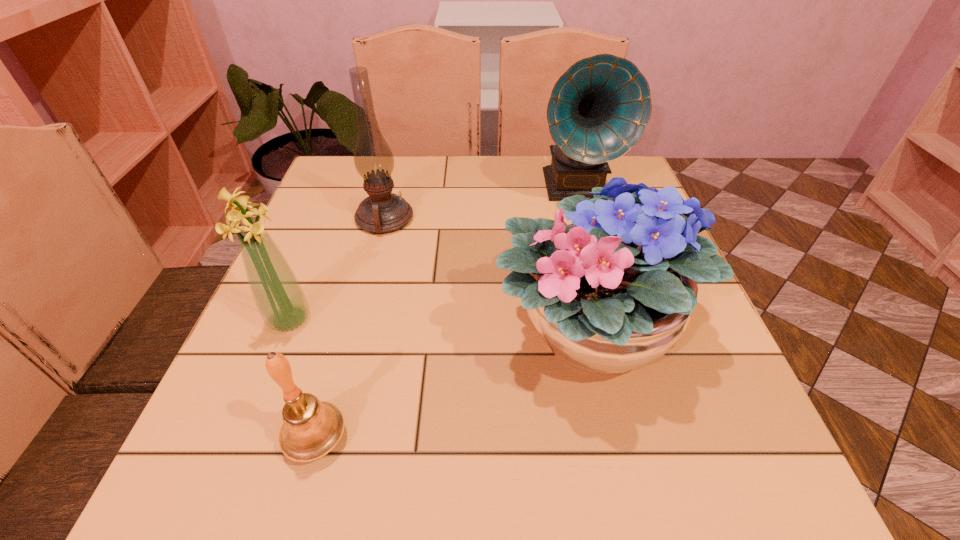
Image resolution: width=960 pixels, height=540 pixels. What are the coordinates of `free spot between the phonograph_record and the bell` in the screenshot? It's located at (446, 313).

Locate an element on the screen. free space that is in between the right bouquet and the left bouquet is located at coordinates (440, 326).

At what (x,y) coordinates should I click in order to perform the action: click on free space that is in between the leftmost object and the shortest object. Please return your answer as a coordinate pair (x, y). Looking at the image, I should click on (303, 379).

Locate an element on the screen. This screenshot has width=960, height=540. vacant point located between the shortest object and the phonograph_record is located at coordinates (446, 313).

Select which object is the second closest to the left bouquet. Please provide its 2D coordinates. Your answer should be formatted as a tuple, i.e. [(x, y)], where the tuple contains the x and y coordinates of a point satisfying the conditions above.

[(382, 212)]

Select which object appears as the third closest to the bell. Please provide its 2D coordinates. Your answer should be formatted as a tuple, i.e. [(x, y)], where the tuple contains the x and y coordinates of a point satisfying the conditions above.

[(382, 212)]

At what (x,y) coordinates should I click in order to perform the action: click on free space that satisfies the following two spatial constraints: 1. from the horn of the phonograph_record; 2. on the front-facing side of the left bouquet. Please return your answer as a coordinate pair (x, y). The image size is (960, 540). Looking at the image, I should click on [x=613, y=320].

This screenshot has height=540, width=960. What are the coordinates of `vacant position in the image that satisfies the following two spatial constraints: 1. on the back side of the oil lamp; 2. on the left side of the bell` in the screenshot? It's located at (377, 218).

At what (x,y) coordinates should I click in order to perform the action: click on free point that satisfies the following two spatial constraints: 1. on the front side of the oil lamp; 2. on the front-facing side of the leftmost object. Please return your answer as a coordinate pair (x, y). The height and width of the screenshot is (540, 960). Looking at the image, I should click on 358,320.

Identify the location of vacant space that satisfies the following two spatial constraints: 1. on the front-facing side of the left bouquet; 2. on the right side of the right bouquet. (284, 333).